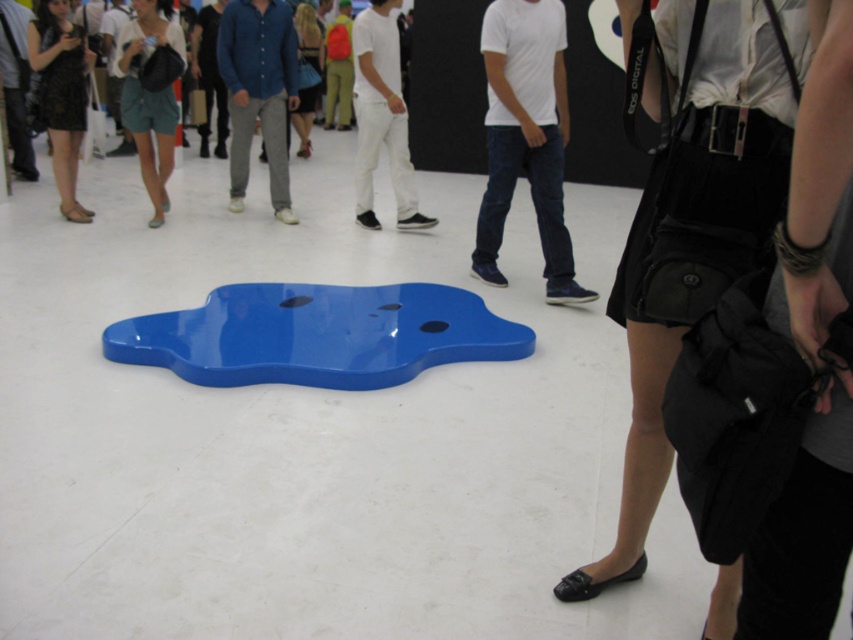
How far apart are black fabric bag at lower right and matte black dress at left?

black fabric bag at lower right and matte black dress at left are 16.61 feet apart from each other.

Is point (817, 358) more distant than point (76, 220)?

That is False.

Describe the element at coordinates (811, 358) in the screenshot. I see `black fabric bag at lower right` at that location.

Image resolution: width=853 pixels, height=640 pixels. I want to click on black fabric bag at lower right, so click(x=811, y=358).

Which is more to the left, black fabric bag at lower right or white matte pants at center?

white matte pants at center

The image size is (853, 640). Find the location of `black fabric bag at lower right`. black fabric bag at lower right is located at coordinates (811, 358).

Identify the location of black fabric bag at lower right. This screenshot has height=640, width=853. (811, 358).

Who is more distant from viewer, (837, 157) or (508, 172)?

The point (508, 172) is more distant.

Can you confirm if black fabric bag at lower right is bigger than white matte t-shirt at center?

No, black fabric bag at lower right is not bigger than white matte t-shirt at center.

Find the location of a particular element. black fabric bag at lower right is located at coordinates (811, 358).